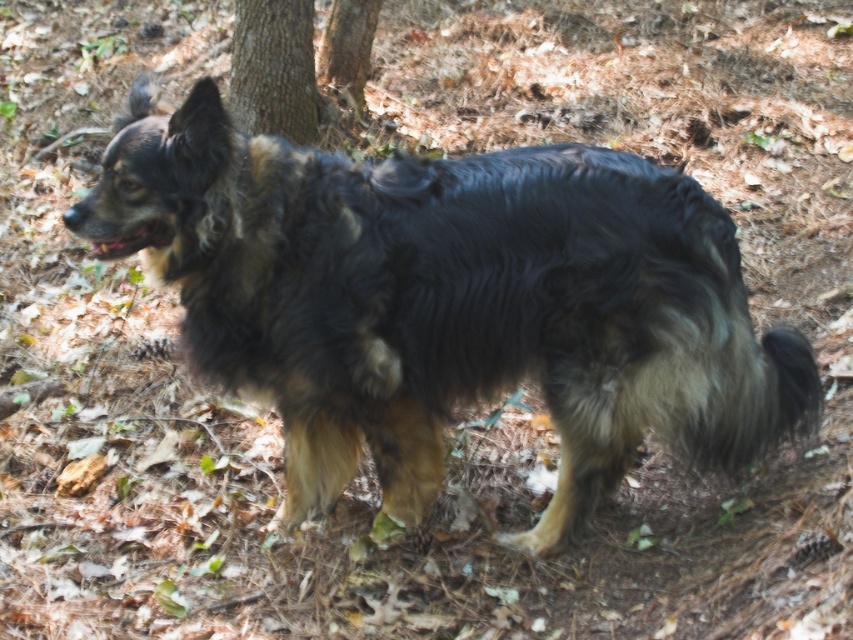
Question: Does shaggy brown dog at center appear on the right side of brown rough bark at upper center?

Choices:
 (A) no
 (B) yes

Answer: (B)

Question: In this image, where is brown rough bark at center located relative to brown rough bark at upper center?

Choices:
 (A) left
 (B) right

Answer: (A)

Question: Is brown rough bark at center thinner than brown rough bark at upper center?

Choices:
 (A) yes
 (B) no

Answer: (B)

Question: Among these points, which one is nearest to the camera?

Choices:
 (A) (329, 54)
 (B) (334, 404)
 (C) (288, 84)

Answer: (B)

Question: Which point is farther to the camera?

Choices:
 (A) brown rough bark at center
 (B) brown rough bark at upper center

Answer: (B)

Question: Which point appears farthest from the camera in this image?

Choices:
 (A) (334, 24)
 (B) (165, 276)
 (C) (252, 52)

Answer: (A)